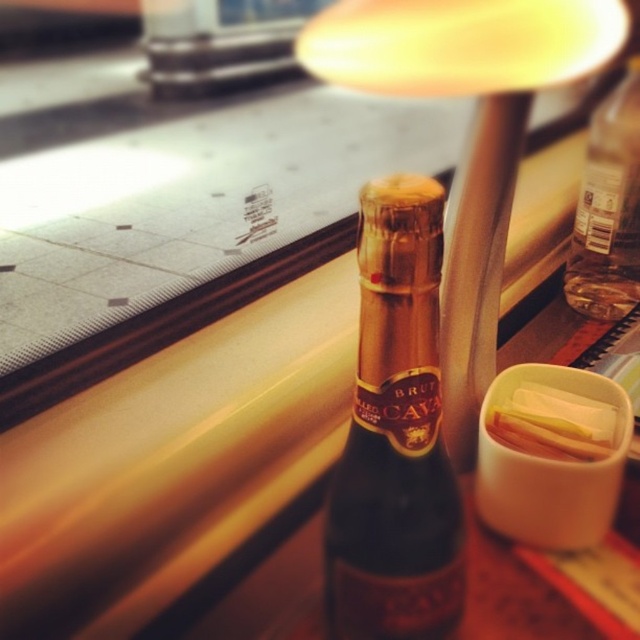
Question: Is transparent plastic bottle at upper right closer to the viewer compared to translucent plastic container at upper right?

Choices:
 (A) yes
 (B) no

Answer: (B)

Question: Is dark brown glass bottle at center bigger than transparent plastic bottle at upper right?

Choices:
 (A) yes
 (B) no

Answer: (A)

Question: Does dark brown glass bottle at center have a greater width compared to translucent plastic container at upper right?

Choices:
 (A) yes
 (B) no

Answer: (B)

Question: Among these objects, which one is farthest from the camera?

Choices:
 (A) translucent plastic container at upper right
 (B) dark brown glass bottle at center

Answer: (A)

Question: Among these objects, which one is nearest to the camera?

Choices:
 (A) dark brown glass bottle at center
 (B) translucent plastic container at upper right
 (C) transparent plastic bottle at upper right

Answer: (A)

Question: Which is nearer to the dark brown glass bottle at center?

Choices:
 (A) translucent plastic container at upper right
 (B) transparent plastic bottle at upper right

Answer: (A)